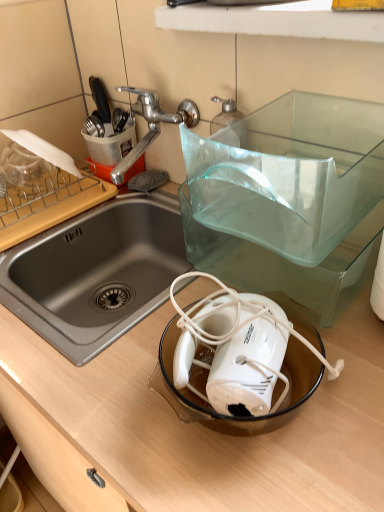
Locate an element on the screen. This screenshot has width=384, height=512. vacant area that is situated to the right of white plastic mixer at center is located at coordinates (345, 384).